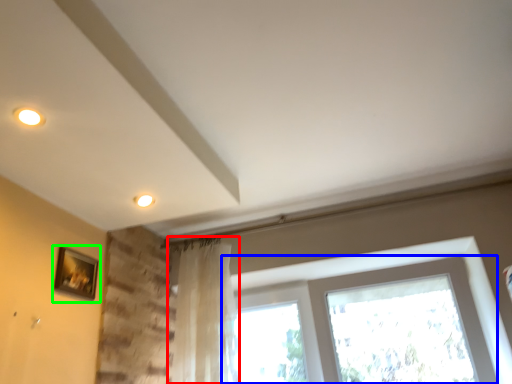
Question: Which is nearer to the curtain (highlighted by a red box)? window (highlighted by a blue box) or picture frame (highlighted by a green box).

Choices:
 (A) window
 (B) picture frame

Answer: (A)